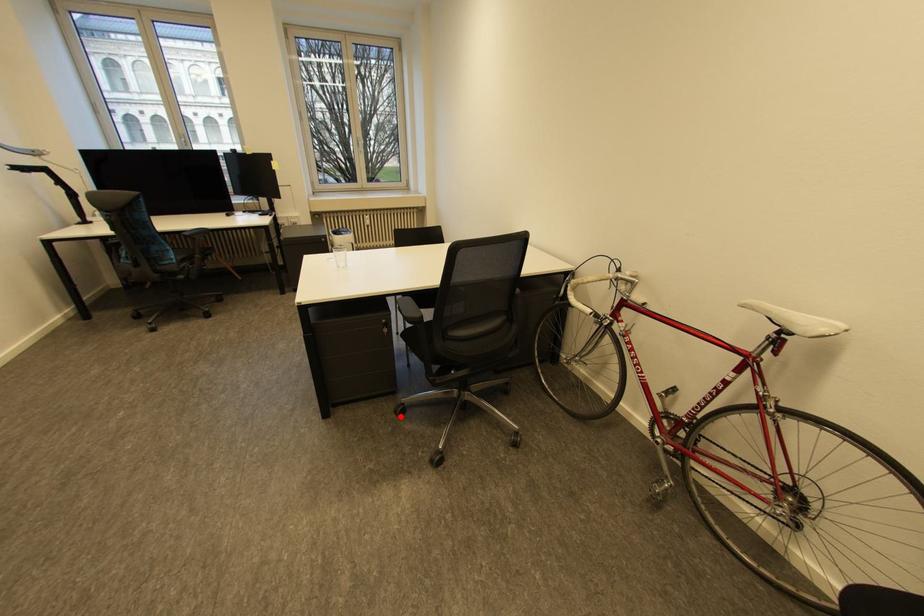
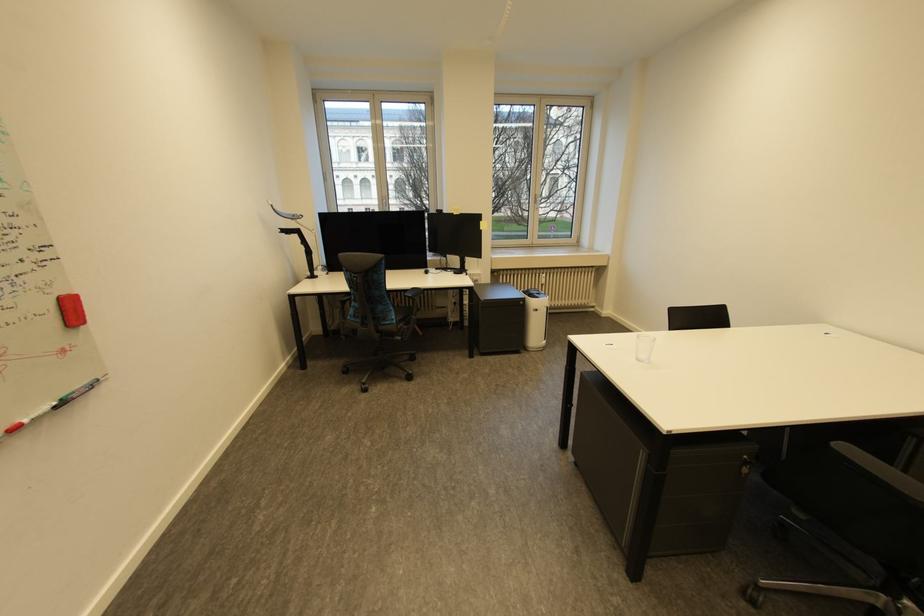
In the second image, find the point that corresponds to the highlighted location in the first image.

(750, 604)